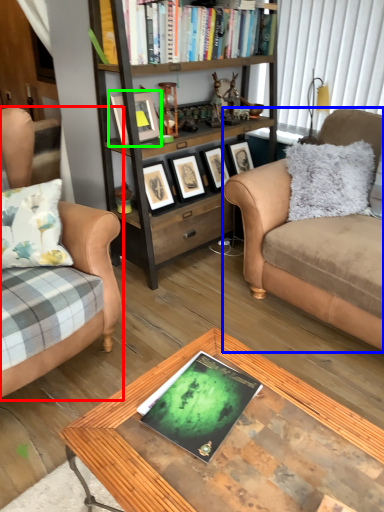
Question: Estimate the real-world distances between objects in this image. Which object is closer to studio couch (highlighted by a red box), studio couch (highlighted by a blue box) or picture frame (highlighted by a green box)?

Choices:
 (A) studio couch
 (B) picture frame

Answer: (B)